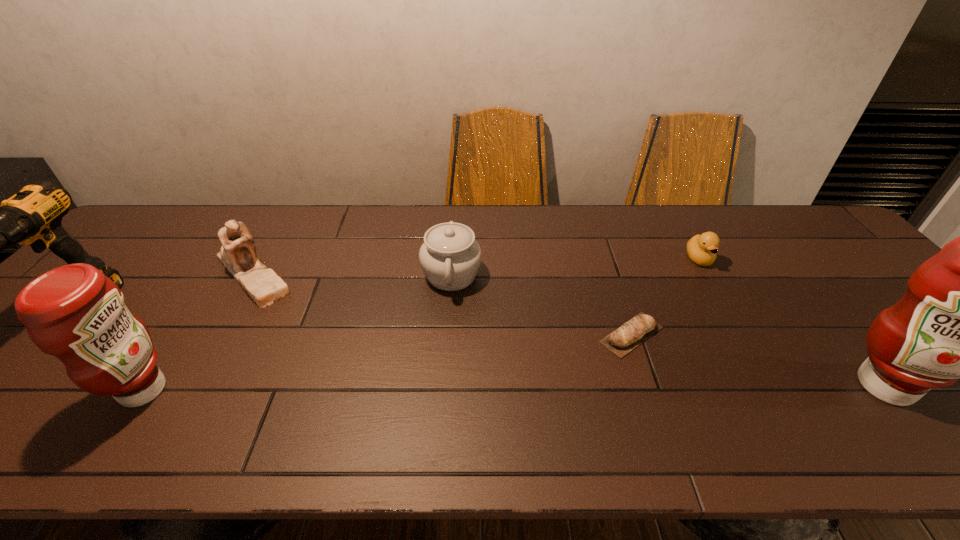
The width and height of the screenshot is (960, 540). In order to click on free space that is in between the figurine and the fourth object from left to right in this screenshot , I will do `click(352, 274)`.

What are the coordinates of `vacant area that lies between the taller condiment and the fourth object from right to left` in the screenshot? It's located at 668,330.

Where is `empty space that is in between the leftmost object and the shortest object`? empty space that is in between the leftmost object and the shortest object is located at coordinates (357, 322).

Find the location of a particular element. The image size is (960, 540). free spot between the leftmost object and the third object from right to left is located at coordinates (357, 322).

Where is `free space between the figurine and the fourth object from right to left`? The width and height of the screenshot is (960, 540). free space between the figurine and the fourth object from right to left is located at coordinates (352, 274).

This screenshot has height=540, width=960. I want to click on vacant area that lies between the left condiment and the shortest object, so click(388, 362).

Find the location of a particular element. The image size is (960, 540). free space between the third object from right to left and the duckling is located at coordinates (665, 297).

Select which object appears as the second closest to the left condiment. Please provide its 2D coordinates. Your answer should be formatted as a tuple, i.e. [(x, y)], where the tuple contains the x and y coordinates of a point satisfying the conditions above.

[(33, 216)]

At what (x,y) coordinates should I click in order to perform the action: click on object that stands as the fourth closest to the pita bread. Please return your answer as a coordinate pair (x, y). The width and height of the screenshot is (960, 540). Looking at the image, I should click on (238, 254).

Locate an element on the screen. free space that satisfies the following two spatial constraints: 1. on the back side of the fifth object from left to right; 2. on the right side of the shorter condiment is located at coordinates (180, 335).